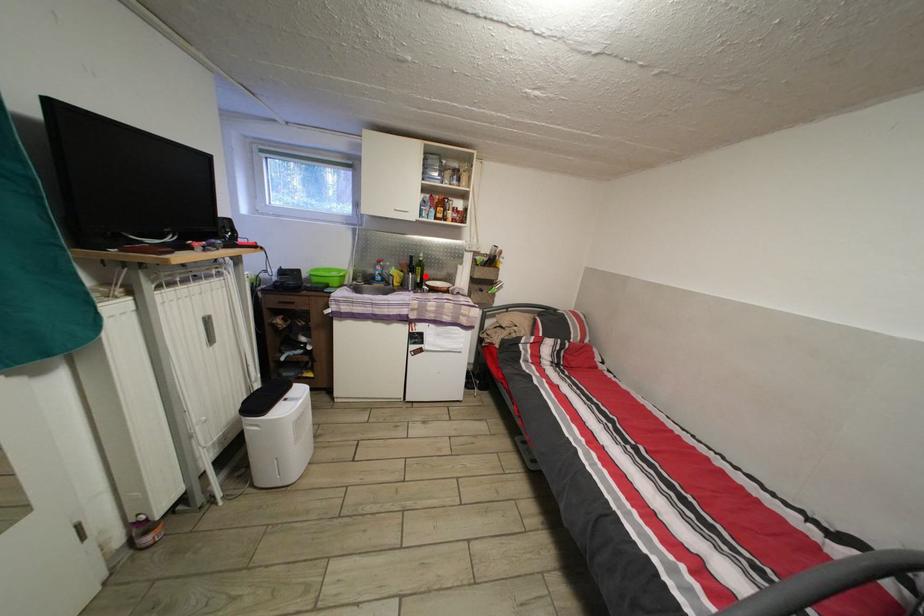
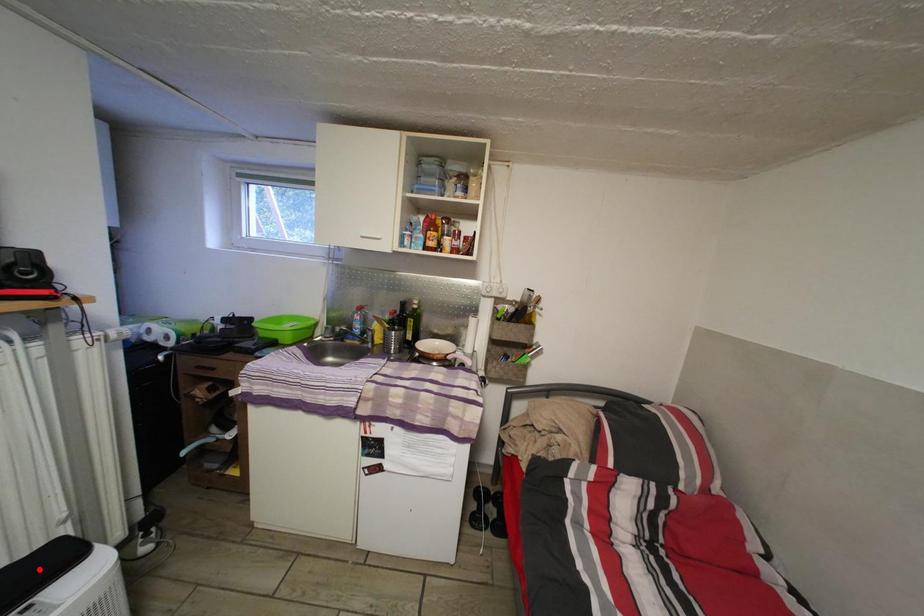
In the scene shown: I am providing you with two images of the same scene from different viewpoints. A red point is marked on the first image and another point is marked on the second image. Is the red point in image1 aligned with the point shown in image2?

No